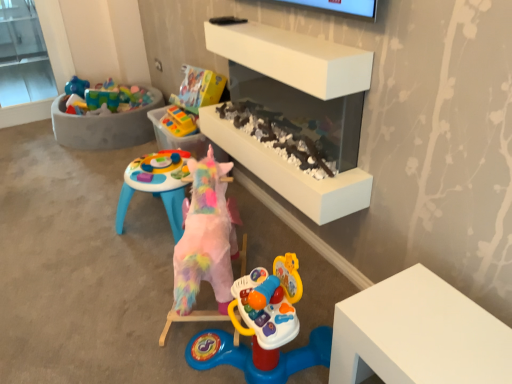
Question: From the image's perspective, does concrete tub at upper left appear lower than rubberized plastic toy at center, which is the second toy from bottom to top?

Choices:
 (A) yes
 (B) no

Answer: (B)

Question: Considering the relative sizes of concrete tub at upper left and rubberized plastic toy at center, which is the second toy from bottom to top, in the image provided, is concrete tub at upper left shorter than rubberized plastic toy at center, which is the second toy from bottom to top,?

Choices:
 (A) yes
 (B) no

Answer: (B)

Question: Does concrete tub at upper left contain rubberized plastic toy at center, the second toy positioned from the front?

Choices:
 (A) yes
 (B) no

Answer: (B)

Question: From a real-world perspective, is concrete tub at upper left below rubberized plastic toy at center, the 1th toy in the top-to-bottom sequence?

Choices:
 (A) yes
 (B) no

Answer: (A)

Question: Is concrete tub at upper left facing towards rubberized plastic toy at center, the 1th toy in the top-to-bottom sequence?

Choices:
 (A) no
 (B) yes

Answer: (A)

Question: Can you confirm if concrete tub at upper left is thinner than rubberized plastic toy at center, which is the first toy in back-to-front order?

Choices:
 (A) no
 (B) yes

Answer: (A)

Question: Are white matte fireplace at center and rubberized plastic toy at center, which is the second toy from bottom to top, located far from each other?

Choices:
 (A) no
 (B) yes

Answer: (A)

Question: From the image's perspective, is white matte fireplace at center under rubberized plastic toy at center, which is the first toy in back-to-front order?

Choices:
 (A) no
 (B) yes

Answer: (B)

Question: Is white matte fireplace at center taller than rubberized plastic toy at center, which is the first toy in back-to-front order?

Choices:
 (A) no
 (B) yes

Answer: (B)

Question: Is white matte fireplace at center bigger than rubberized plastic toy at center, which is the second toy from bottom to top?

Choices:
 (A) no
 (B) yes

Answer: (B)

Question: Can you confirm if white matte fireplace at center is positioned to the right of rubberized plastic toy at center, which is the second toy from bottom to top?

Choices:
 (A) yes
 (B) no

Answer: (A)

Question: Is the depth of white matte fireplace at center greater than that of rubberized plastic toy at center, the 1th toy in the top-to-bottom sequence?

Choices:
 (A) yes
 (B) no

Answer: (B)

Question: Considering the relative positions of fuzzy pink unicorn at center, which is the second toy in back-to-front order, and rubberized plastic toy at center, which is the first toy in back-to-front order, in the image provided, is fuzzy pink unicorn at center, which is the second toy in back-to-front order, to the right of rubberized plastic toy at center, which is the first toy in back-to-front order, from the viewer's perspective?

Choices:
 (A) no
 (B) yes

Answer: (B)